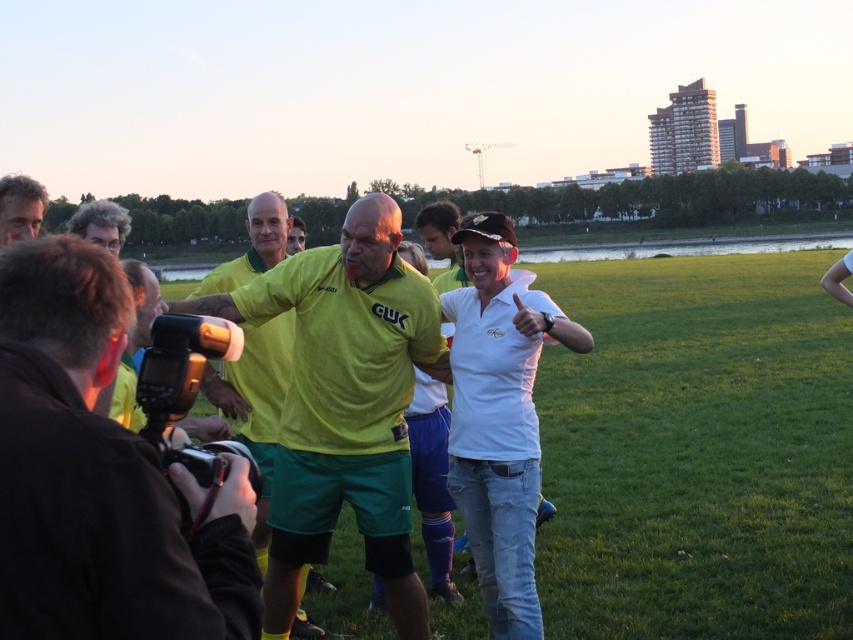
Between yellow-green jersey at center and matte green shorts at center, which one appears on the right side from the viewer's perspective?

Positioned to the right is yellow-green jersey at center.

What are the coordinates of `yellow-green jersey at center` in the screenshot? It's located at (97, 476).

At what (x,y) coordinates should I click in order to perform the action: click on yellow-green jersey at center. Please return your answer as a coordinate pair (x, y). This screenshot has height=640, width=853. Looking at the image, I should click on (97, 476).

Looking at this image, is matte green shorts at center further to the viewer compared to curly hair at upper left?

Yes, matte green shorts at center is further from the viewer.

Can you confirm if matte green shorts at center is taller than curly hair at upper left?

No.

Identify the location of matte green shorts at center. This screenshot has width=853, height=640. (345, 403).

Locate an element on the screen. The height and width of the screenshot is (640, 853). matte green shorts at center is located at coordinates (345, 403).

Can you confirm if yellow-green jersey at center is positioned below curly hair at left?

Correct, yellow-green jersey at center is located below curly hair at left.

Does point (131, 291) come behind point (44, 202)?

No, it is not.

At what (x,y) coordinates should I click in order to perform the action: click on yellow-green jersey at center. Please return your answer as a coordinate pair (x, y). The height and width of the screenshot is (640, 853). Looking at the image, I should click on (97, 476).